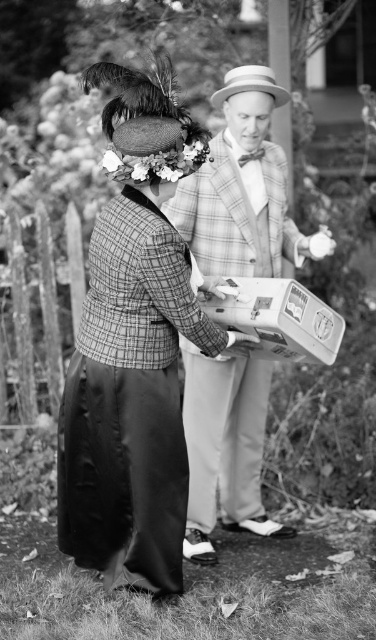
You are an observer looking at the image of two people in a garden. The plaid wool jacket at center and plaid wool suit at center are both visible. Which one is positioned to the left?

The plaid wool jacket at center is to the left of plaid wool suit at center.